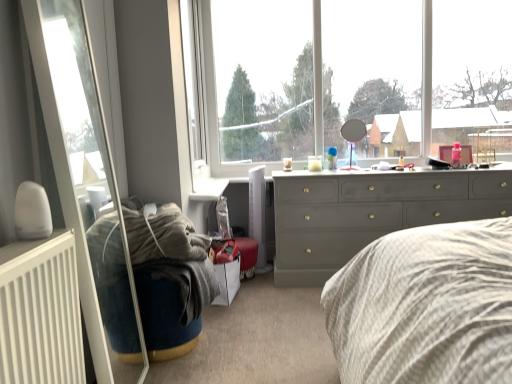
Question: In terms of size, does white matte radiator at lower left appear bigger or smaller than matte gray dresser at center?

Choices:
 (A) big
 (B) small

Answer: (B)

Question: From a real-world perspective, relative to matte gray dresser at center, is white matte radiator at lower left vertically above or below?

Choices:
 (A) below
 (B) above

Answer: (B)

Question: Estimate the real-world distances between objects in this image. Which object is closer to the matte gray dresser at center?

Choices:
 (A) white matte radiator at lower left
 (B) transparent glass door at left
 (C) velvet blue bean bag at lower left
 (D) transparent glass mirror at upper center

Answer: (D)

Question: Estimate the real-world distances between objects in this image. Which object is closer to the matte gray dresser at center?

Choices:
 (A) velvet blue bean bag at lower left
 (B) white matte radiator at lower left
 (C) transparent glass door at left
 (D) transparent glass mirror at upper center

Answer: (D)